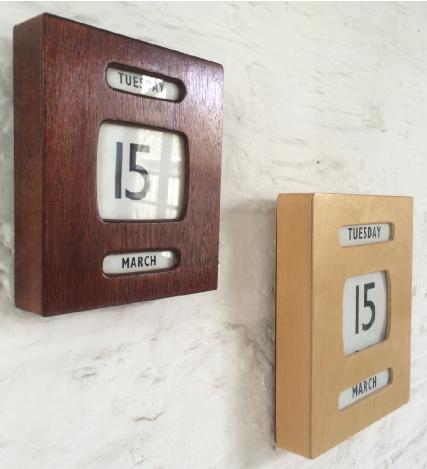
Identify the location of wall. (x=206, y=395), (x=297, y=57).